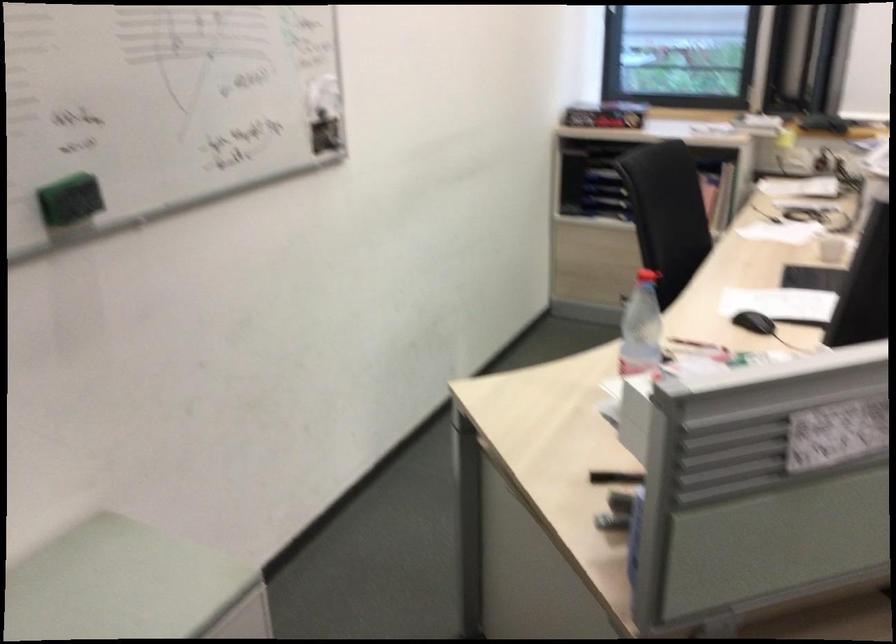
Locate an element on the screen. red pen is located at coordinates (695, 345).